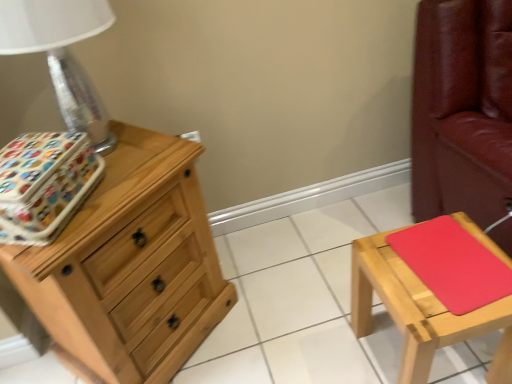
Find the location of `vacant area to the right of natural wood chest of drawers at left`. vacant area to the right of natural wood chest of drawers at left is located at coordinates (273, 307).